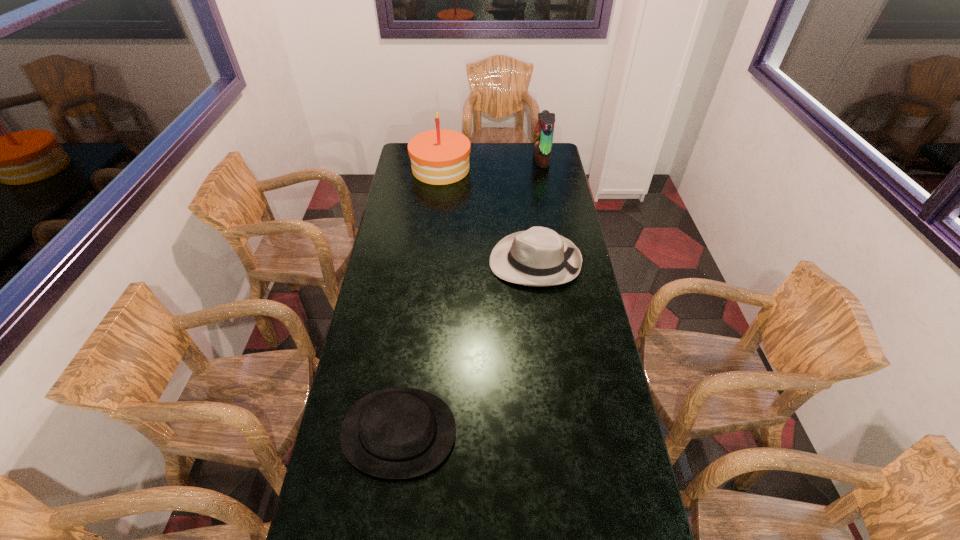
In order to click on blank space located on the front-facing side of the farther fedora in this screenshot , I will do coord(430,262).

I want to click on vacant space situated 0.390m on the front-facing side of the farther fedora, so click(394, 262).

Identify the location of vacant space located 0.340m on the front-facing side of the farther fedora. The height and width of the screenshot is (540, 960). (406, 262).

Where is `free space located 0.060m on the right of the nearer fedora`? Image resolution: width=960 pixels, height=540 pixels. free space located 0.060m on the right of the nearer fedora is located at coordinates (476, 432).

Where is `birthday cake present at the far edge`? birthday cake present at the far edge is located at coordinates (438, 157).

Find the location of a particular element. The width and height of the screenshot is (960, 540). parrot that is at the far edge is located at coordinates (544, 130).

At what (x,y) coordinates should I click in order to perform the action: click on birthday cake that is positioned at the left edge. Please return your answer as a coordinate pair (x, y). Image resolution: width=960 pixels, height=540 pixels. Looking at the image, I should click on (438, 157).

Locate an element on the screen. fedora located at the left edge is located at coordinates (395, 433).

Locate an element on the screen. The width and height of the screenshot is (960, 540). parrot that is at the right edge is located at coordinates (544, 130).

Locate an element on the screen. The height and width of the screenshot is (540, 960). fedora present at the right edge is located at coordinates (539, 256).